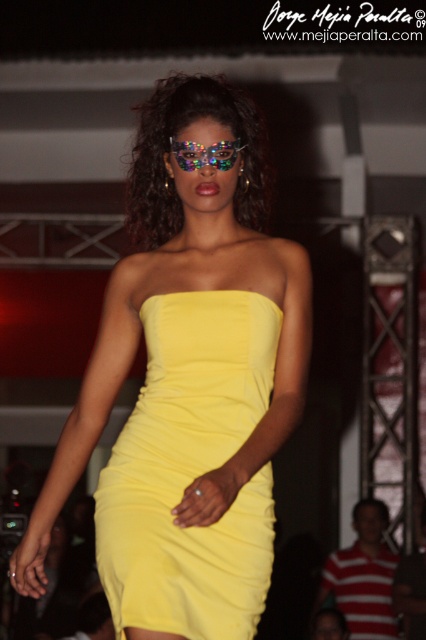
At what (x,y) coordinates should I click in order to perform the action: click on yellow matte dress at center. Please return your answer as a coordinate pair (x, y). This screenshot has height=640, width=426. Looking at the image, I should click on (189, 381).

Based on the photo, is yellow matte dress at center positioned behind holographic plastic goggles at center?

No, it is not.

Is point (242, 230) closer to viewer compared to point (199, 156)?

No, (242, 230) is further to viewer.

In order to click on yellow matte dress at center in this screenshot , I will do `click(189, 381)`.

From the picture: Is yellow matte dress at center thinner than yellow satin dress at center?

No, yellow matte dress at center is not thinner than yellow satin dress at center.

Between point (215, 285) and point (143, 458), which one is positioned in front?

Point (143, 458)

Is point (176, 536) less distant than point (207, 589)?

No, (176, 536) is behind (207, 589).

Identify the location of yellow matte dress at center. tap(189, 381).

Is yellow satin dress at center shorter than holographic plastic goggles at center?

Incorrect, yellow satin dress at center's height does not fall short of holographic plastic goggles at center's.

This screenshot has width=426, height=640. Describe the element at coordinates (190, 470) in the screenshot. I see `yellow satin dress at center` at that location.

The width and height of the screenshot is (426, 640). Describe the element at coordinates (190, 470) in the screenshot. I see `yellow satin dress at center` at that location.

The image size is (426, 640). Find the location of `yellow satin dress at center`. yellow satin dress at center is located at coordinates (190, 470).